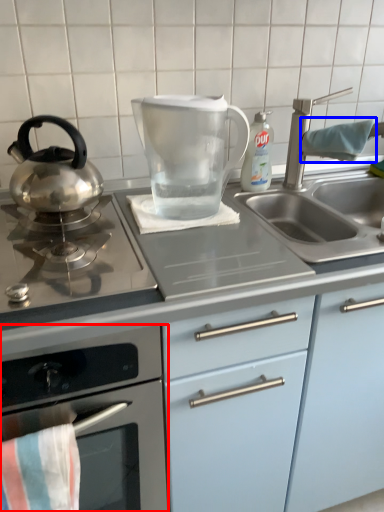
Question: Which point is further to the camera, kitchen appliance (highlighted by a red box) or beach towel (highlighted by a blue box)?

Choices:
 (A) kitchen appliance
 (B) beach towel

Answer: (B)